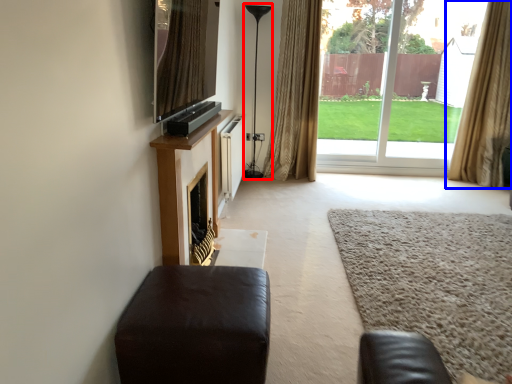
Question: Among these objects, which one is farthest to the camera, lamp (highlighted by a red box) or curtain (highlighted by a blue box)?

Choices:
 (A) lamp
 (B) curtain

Answer: (A)